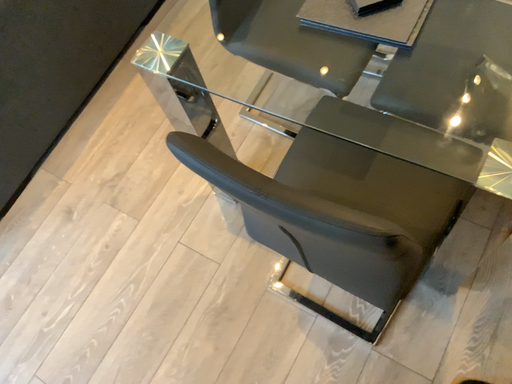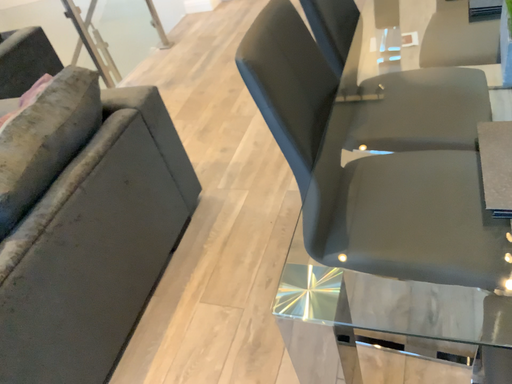
Question: Which way did the camera rotate in the video?

Choices:
 (A) rotated upward
 (B) rotated downward

Answer: (A)